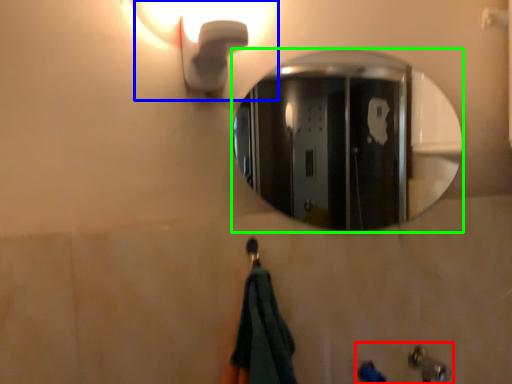
Question: Which object is the farthest from sink (highlighted by a red box)? Choose among these: light fixture (highlighted by a blue box) or mirror (highlighted by a green box).

Choices:
 (A) light fixture
 (B) mirror

Answer: (B)